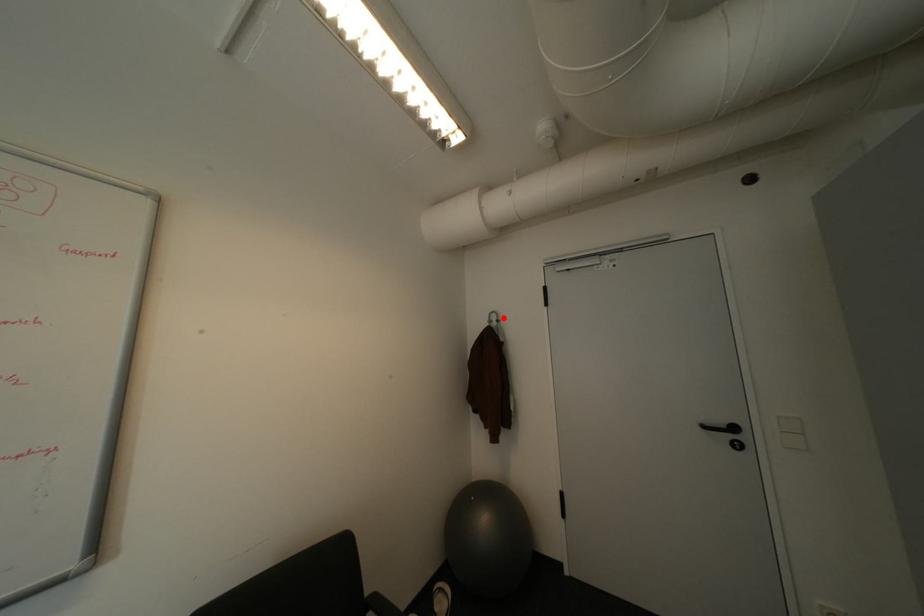
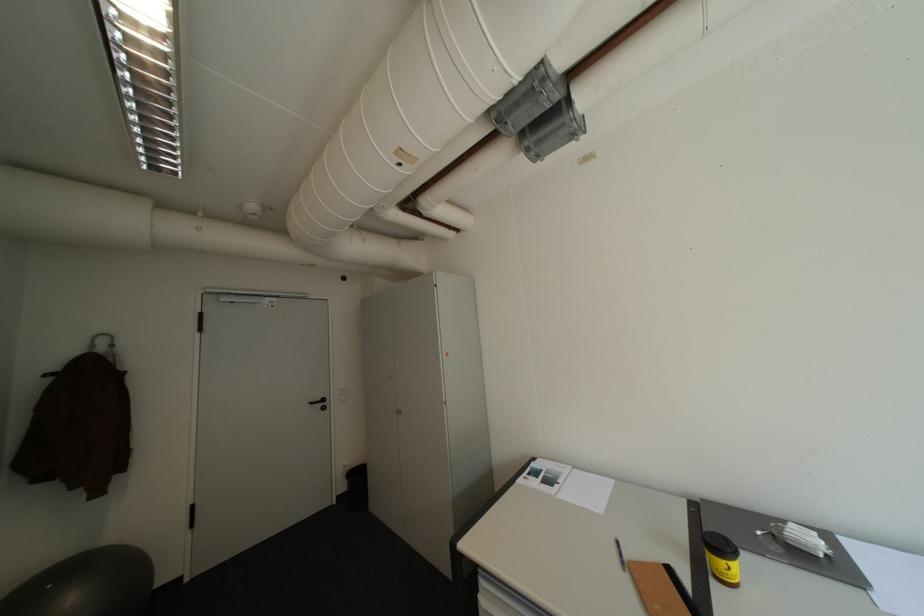
In the second image, find the point that corresponds to the highlighted location in the first image.

(113, 342)